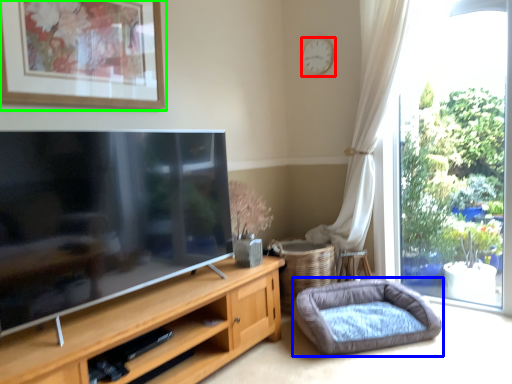
Question: Estimate the real-world distances between objects in this image. Which object is closer to clock (highlighted by a red box), dog bed (highlighted by a blue box) or picture frame (highlighted by a green box)?

Choices:
 (A) dog bed
 (B) picture frame

Answer: (B)